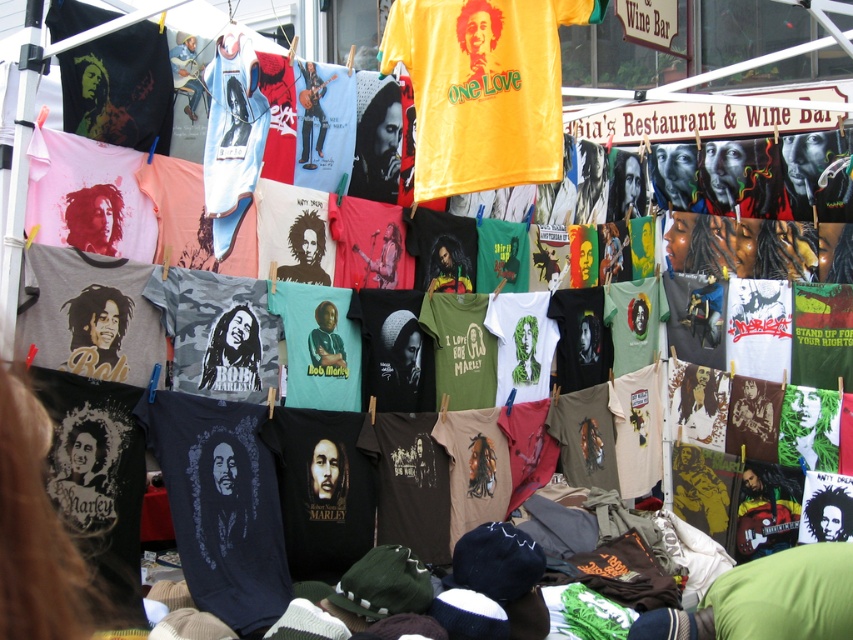
Looking at this image, does yellow matte t-shirt at center appear under green matte t-shirt at center?

Actually, yellow matte t-shirt at center is above green matte t-shirt at center.

Between yellow matte t-shirt at center and green matte t-shirt at center, which one appears on the left side from the viewer's perspective?

From the viewer's perspective, yellow matte t-shirt at center appears more on the left side.

Identify the location of yellow matte t-shirt at center. The height and width of the screenshot is (640, 853). (482, 88).

The image size is (853, 640). I want to click on yellow matte t-shirt at center, so click(x=482, y=88).